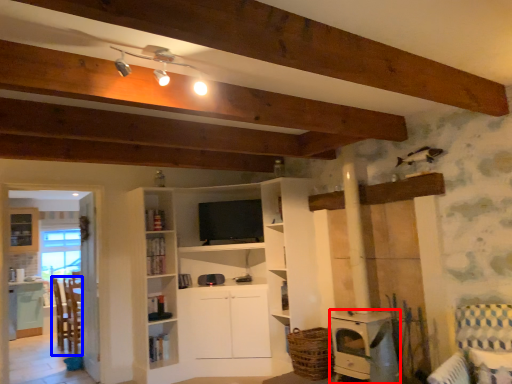
Question: Which object appears farthest to the camera in this image, appliance (highlighted by a red box) or chair (highlighted by a blue box)?

Choices:
 (A) appliance
 (B) chair

Answer: (B)